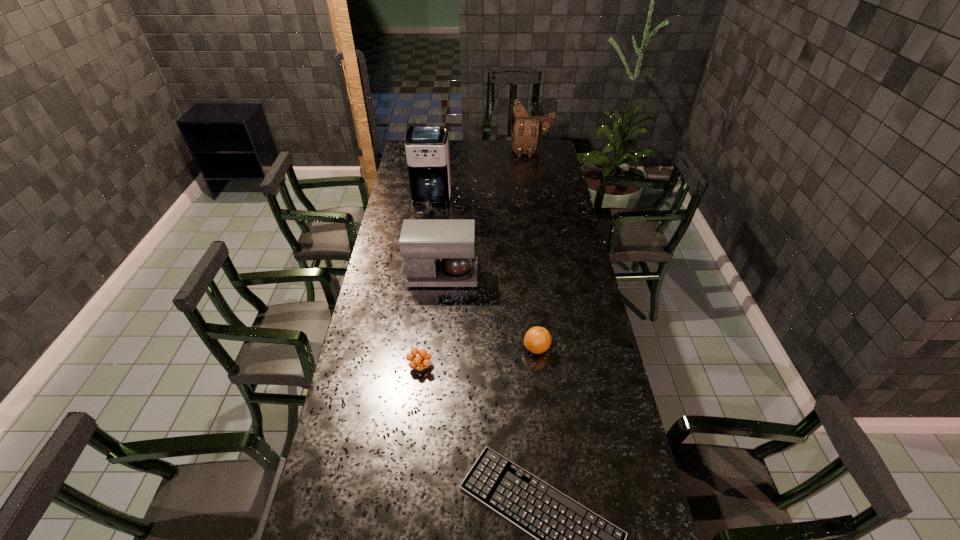
Locate an element on the screen. free space at the right edge of the desktop is located at coordinates (540, 235).

Locate an element on the screen. free region at the far right corner of the desktop is located at coordinates (545, 150).

Locate an element on the screen. This screenshot has width=960, height=540. free space that is in between the second tallest object and the nearer coffee maker is located at coordinates (487, 213).

Find the location of `free space that is in between the right orange fruit and the shorter coffee maker`. free space that is in between the right orange fruit and the shorter coffee maker is located at coordinates (490, 312).

The width and height of the screenshot is (960, 540). Find the location of `vacant area between the fifth nearest object and the shoulder bag`. vacant area between the fifth nearest object and the shoulder bag is located at coordinates (482, 176).

What are the coordinates of `unoccupied position between the left orange fruit and the nearer coffee maker` in the screenshot? It's located at (432, 321).

Identify which object is located as the third nearest to the third shortest object. Please provide its 2D coordinates. Your answer should be formatted as a tuple, i.e. [(x, y)], where the tuple contains the x and y coordinates of a point satisfying the conditions above.

[(571, 539)]

Where is `object identified as the fifth closest to the nearer coffee maker`? object identified as the fifth closest to the nearer coffee maker is located at coordinates (527, 130).

Find the location of a particular element. The image size is (960, 540). free location that satisfies the following two spatial constraints: 1. on the front-facing side of the fifth shortest object; 2. on the carafe side of the shorter coffee maker is located at coordinates (553, 275).

Image resolution: width=960 pixels, height=540 pixels. I want to click on vacant region that satisfies the following two spatial constraints: 1. on the front panel of the tallest object; 2. on the left side of the shorter orange fruit, so click(x=409, y=366).